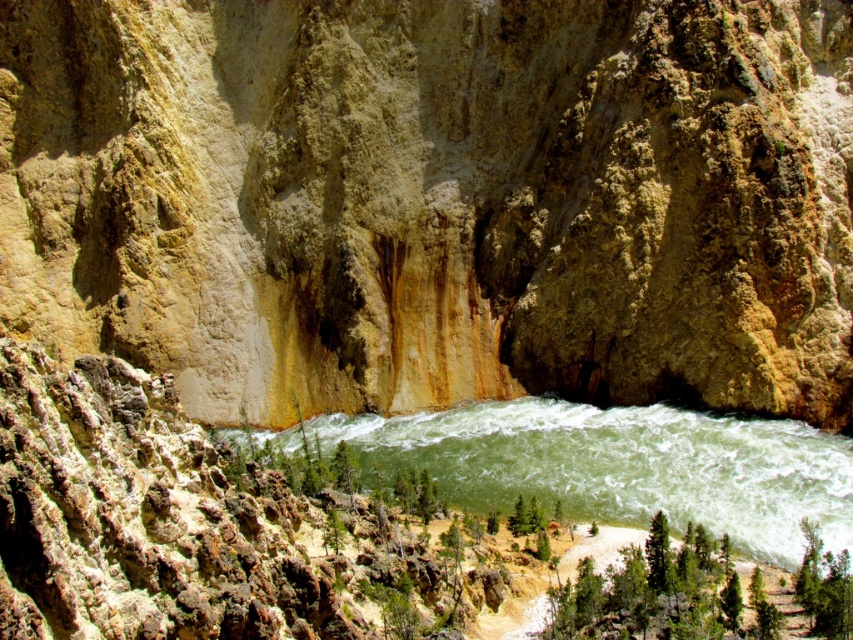
You are a hiker who wants to cross the river using a small wooden bridge. The bridge can only support a width of 2 meters. Can you safely cross the river using the bridge if the green smooth water at center is wider than the green leafy tree at lower center?

The green smooth water at center is wider than the green leafy tree at lower center. Since the bridge can support up to 2 meters, but the width of the water isn directly mentioned, we cannot determine if it is safe to cross. More information about the actual width of the water is needed.

You are a hiker planning to cross the river using a narrow path between the green smooth water at center and the green leafy tree at lower center. The path is only 2 meters wide. Can you safely pass through without getting too close to the water?

The distance between the green smooth water at center and the green leafy tree at lower center is 19.70 meters. Since the path is 2 meters wide, you can safely pass through without getting too close to the water.

You are standing at the edge of the cliffs in the image and want to reach the green leafy tree at lower center. Which direction should you move to get closer to the tree without crossing the green smooth water at center?

Since the green smooth water at center is closer to the viewer than the green leafy tree at lower center, you should move forward towards the tree, as the water is between you and the tree. However, to avoid crossing the water, you might need to navigate around it by moving along the cliffs or finding a path that bypasses the water.